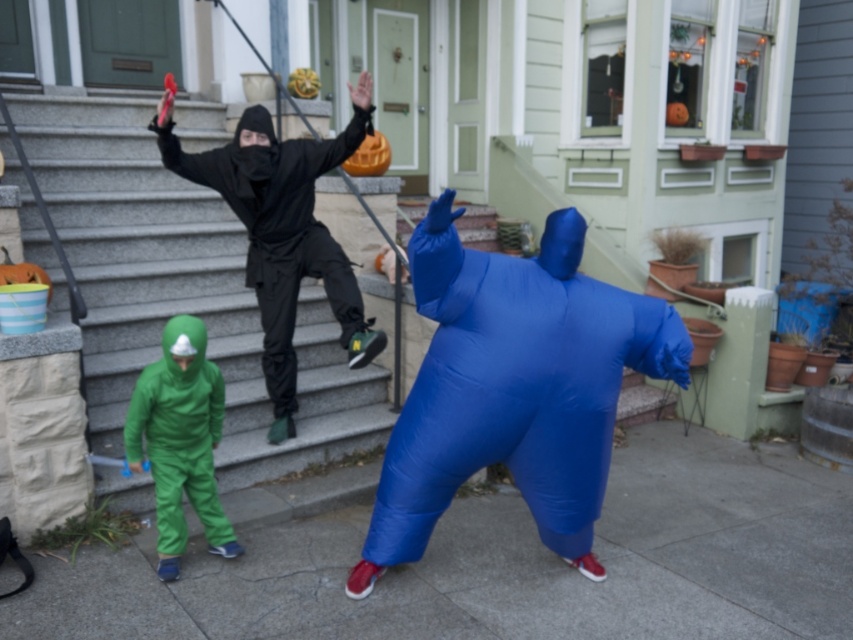
Is blue inflatable at center shorter than matte black ninja at upper center?

Correct, blue inflatable at center is not as tall as matte black ninja at upper center.

Is blue inflatable at center to the left of matte black ninja at upper center from the viewer's perspective?

Incorrect, blue inflatable at center is not on the left side of matte black ninja at upper center.

Is point (556, 381) closer to viewer compared to point (358, 321)?

Yes.

At what (x,y) coordinates should I click in order to perform the action: click on blue inflatable at center. Please return your answer as a coordinate pair (x, y). Looking at the image, I should click on (514, 387).

Is smooth concrete stairs at upper center above matte black ninja at upper center?

Yes.

Does smooth concrete stairs at upper center come in front of matte black ninja at upper center?

No, it is not.

Is point (219, 342) more distant than point (259, 250)?

Yes, it is behind point (259, 250).

Find the location of `smooth concrete stairs at upper center`. smooth concrete stairs at upper center is located at coordinates (183, 291).

Does smooth concrete stairs at upper center have a smaller size compared to blue inflatable at center?

Actually, smooth concrete stairs at upper center might be larger than blue inflatable at center.

The width and height of the screenshot is (853, 640). What are the coordinates of `smooth concrete stairs at upper center` in the screenshot? It's located at (183, 291).

You are a GUI agent. You are given a task and a screenshot of the screen. Output one action in this format:
    pyautogui.click(x=<x>, y=<y>)
    Task: Click on the smooth concrete stairs at upper center
    This screenshot has width=853, height=640.
    Given the screenshot: What is the action you would take?
    pyautogui.click(x=183, y=291)